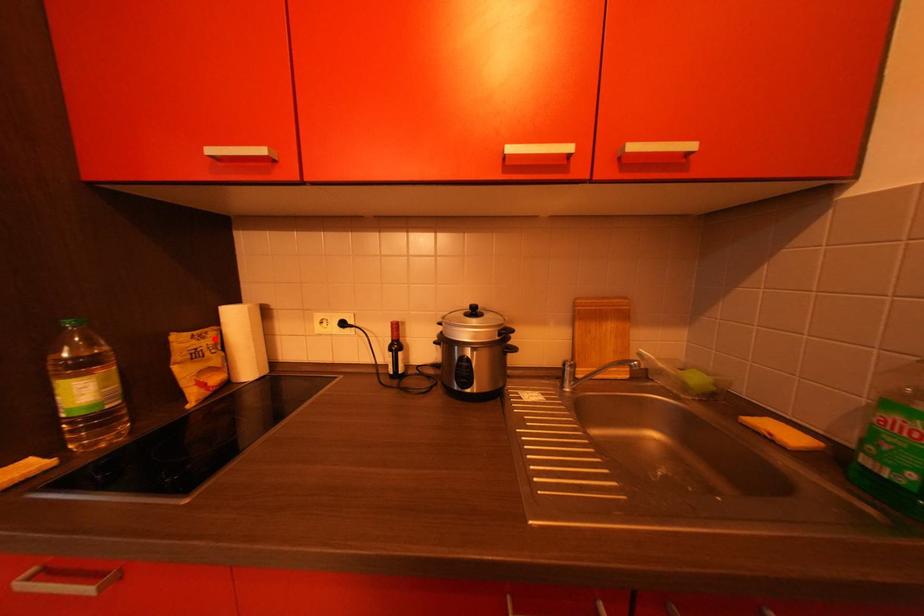
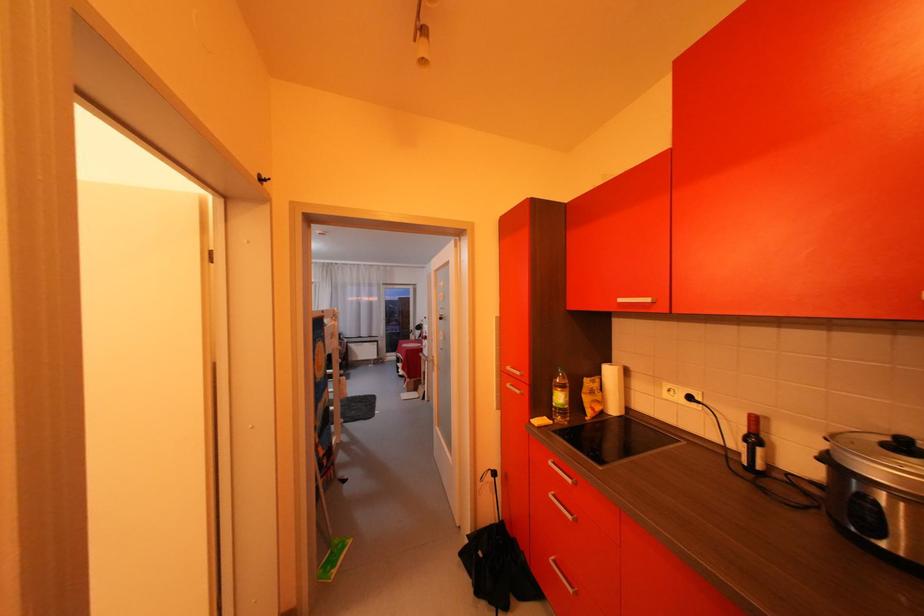
Where in the second image is the point corresponding to the highlighted location from the first image?

(605, 383)